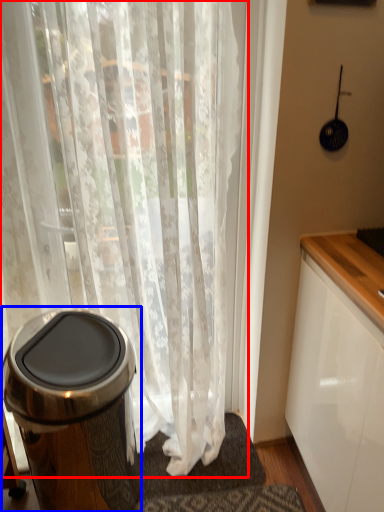
Question: Which of the following is the farthest to the observer, curtain (highlighted by a red box) or waste container (highlighted by a blue box)?

Choices:
 (A) curtain
 (B) waste container

Answer: (B)